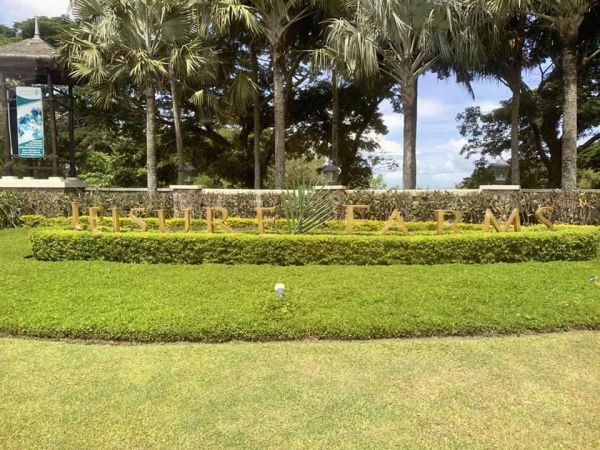
Identify the location of light. (276, 293).